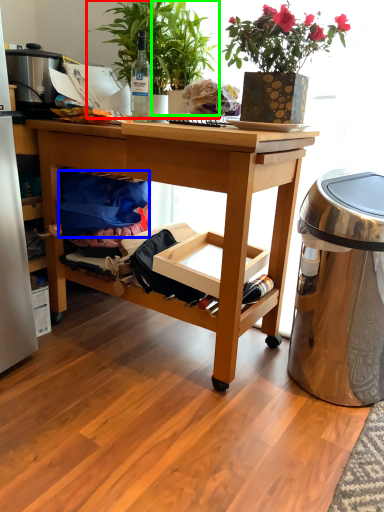
Question: Which object is positioned farthest from houseplant (highlighted by a red box)? Select from material (highlighted by a blue box) and houseplant (highlighted by a green box).

Choices:
 (A) material
 (B) houseplant

Answer: (A)